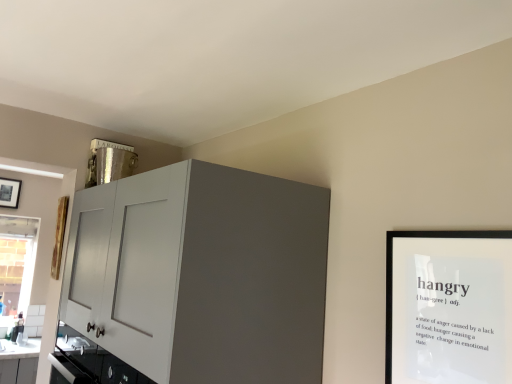
The height and width of the screenshot is (384, 512). Describe the element at coordinates (449, 307) in the screenshot. I see `black matte picture frame at upper right` at that location.

You are a GUI agent. You are given a task and a screenshot of the screen. Output one action in this format:
    pyautogui.click(x=<x>, y=<y>)
    Task: Click on the clear glass window at lower left
    
    Given the screenshot: What is the action you would take?
    pyautogui.click(x=17, y=262)

Where is `window below the matte white cabinet at upper left (from the image's perspective)`? This screenshot has height=384, width=512. window below the matte white cabinet at upper left (from the image's perspective) is located at coordinates (17, 262).

Can you confirm if matte white cabinet at upper left is taller than clear glass window at lower left?

Indeed, matte white cabinet at upper left has a greater height compared to clear glass window at lower left.

From the image's perspective, would you say matte white cabinet at upper left is positioned over clear glass window at lower left?

Correct, matte white cabinet at upper left appears higher than clear glass window at lower left in the image.

How different are the orientations of matte white cabinet at upper left and clear glass window at lower left in degrees?

The angular difference between matte white cabinet at upper left and clear glass window at lower left is 90.5 degrees.

Between point (92, 309) and point (442, 244), which one is positioned in front?

The point (442, 244) is closer.

Where is `cabinetry below the black matte picture frame at upper right (from a real-world perspective)`? This screenshot has width=512, height=384. cabinetry below the black matte picture frame at upper right (from a real-world perspective) is located at coordinates (197, 278).

Is matte white cabinet at upper left spatially inside black matte picture frame at upper right, or outside of it?

matte white cabinet at upper left is not inside black matte picture frame at upper right, it's outside.

Considering the positions of objects matte white cabinet at upper left and black matte picture frame at upper right in the image provided, who is behind, matte white cabinet at upper left or black matte picture frame at upper right?

matte white cabinet at upper left.

Considering the relative sizes of clear glass window at lower left and matte white cabinet at upper left in the image provided, is clear glass window at lower left smaller than matte white cabinet at upper left?

Yes.

Is matte white cabinet at upper left at the back of clear glass window at lower left?

No, clear glass window at lower left is not facing the opposite direction of matte white cabinet at upper left.

From the image's perspective, is clear glass window at lower left under matte white cabinet at upper left?

Yes.

Visually, is clear glass window at lower left positioned to the left or to the right of matte white cabinet at upper left?

In the image, clear glass window at lower left appears on the left side of matte white cabinet at upper left.

Is black matte picture frame at upper right not within clear glass window at lower left?

Yes, black matte picture frame at upper right is outside of clear glass window at lower left.

Does black matte picture frame at upper right have a greater height compared to clear glass window at lower left?

No, black matte picture frame at upper right is not taller than clear glass window at lower left.

Which point is more distant from viewer, (486, 380) or (19, 272)?

Positioned behind is point (19, 272).

Considering the sizes of objects black matte picture frame at upper right and clear glass window at lower left in the image provided, who is smaller, black matte picture frame at upper right or clear glass window at lower left?

Smaller between the two is black matte picture frame at upper right.

Find the location of a particular element. picture frame above the clear glass window at lower left (from a real-world perspective) is located at coordinates (449, 307).

Is clear glass window at lower left not near black matte picture frame at upper right?

clear glass window at lower left is positioned a significant distance from black matte picture frame at upper right.

Would you say clear glass window at lower left contains black matte picture frame at upper right?

That's incorrect, black matte picture frame at upper right is not inside clear glass window at lower left.

Is clear glass window at lower left turned away from black matte picture frame at upper right?

No, clear glass window at lower left is not facing the opposite direction of black matte picture frame at upper right.

Who is bigger, black matte picture frame at upper right or matte white cabinet at upper left?

matte white cabinet at upper left is bigger.

Considering the relative positions of black matte picture frame at upper right and matte white cabinet at upper left in the image provided, is black matte picture frame at upper right to the left or to the right of matte white cabinet at upper left?

black matte picture frame at upper right is to the right of matte white cabinet at upper left.

Does point (405, 345) come in front of point (322, 337)?

Yes.

Is black matte picture frame at upper right positioned before matte white cabinet at upper left?

Yes, it is.

Image resolution: width=512 pixels, height=384 pixels. What are the coordinates of `window located below the matte white cabinet at upper left (from the image's perspective)` in the screenshot? It's located at (17, 262).

Identify the location of picture frame above the matte white cabinet at upper left (from the image's perspective). The height and width of the screenshot is (384, 512). (449, 307).

When comparing their distances from black matte picture frame at upper right, does matte white cabinet at upper left or clear glass window at lower left seem further?

Among the two, clear glass window at lower left is located further to black matte picture frame at upper right.

In the scene shown: Based on their spatial positions, is matte white cabinet at upper left or black matte picture frame at upper right further from clear glass window at lower left?

black matte picture frame at upper right is further to clear glass window at lower left.

Estimate the real-world distances between objects in this image. Which object is further from black matte picture frame at upper right, clear glass window at lower left or matte white cabinet at upper left?

clear glass window at lower left.

Considering their positions, is black matte picture frame at upper right positioned closer to matte white cabinet at upper left than clear glass window at lower left?

black matte picture frame at upper right.

From the image, which object appears to be farther from clear glass window at lower left, black matte picture frame at upper right or matte white cabinet at upper left?

black matte picture frame at upper right.

Considering their positions, is clear glass window at lower left positioned closer to matte white cabinet at upper left than black matte picture frame at upper right?

Among the two, black matte picture frame at upper right is located nearer to matte white cabinet at upper left.

Find the location of a particular element. The width and height of the screenshot is (512, 384). cabinetry located between black matte picture frame at upper right and clear glass window at lower left in the depth direction is located at coordinates (197, 278).